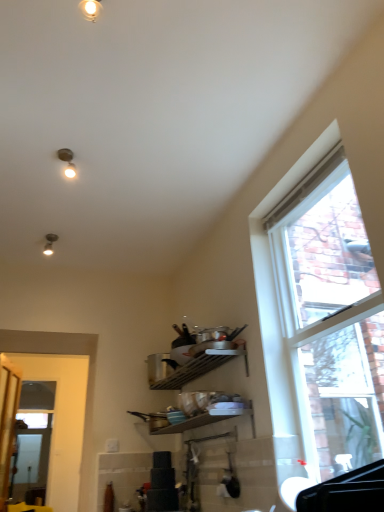
Question: Is matte silver light fixture at upper left, which ranks as the 1th light fixture in left-to-right order, further to the viewer compared to clear glass window at right?

Choices:
 (A) no
 (B) yes

Answer: (B)

Question: Does matte silver light fixture at upper left, which ranks as the 1th light fixture in left-to-right order, have a lesser height compared to clear glass window at right?

Choices:
 (A) yes
 (B) no

Answer: (A)

Question: Can you confirm if matte silver light fixture at upper left, the first light fixture from the back, is wider than clear glass window at right?

Choices:
 (A) yes
 (B) no

Answer: (B)

Question: From a real-world perspective, is matte silver light fixture at upper left, which is the 1th light fixture in bottom-to-top order, located higher than clear glass window at right?

Choices:
 (A) yes
 (B) no

Answer: (A)

Question: Can you confirm if matte silver light fixture at upper left, the first light fixture from the back, is smaller than clear glass window at right?

Choices:
 (A) yes
 (B) no

Answer: (A)

Question: Is matte silver light fixture at upper left, the 2th light fixture positioned from the right, turned away from clear glass window at right?

Choices:
 (A) no
 (B) yes

Answer: (A)

Question: Considering the relative sizes of clear glass window at right and clear glass screen door at left in the image provided, is clear glass window at right wider than clear glass screen door at left?

Choices:
 (A) yes
 (B) no

Answer: (A)

Question: From the image's perspective, is clear glass window at right under clear glass screen door at left?

Choices:
 (A) yes
 (B) no

Answer: (B)

Question: Considering the relative sizes of clear glass window at right and clear glass screen door at left in the image provided, is clear glass window at right shorter than clear glass screen door at left?

Choices:
 (A) no
 (B) yes

Answer: (B)

Question: Can clear glass screen door at left be found inside clear glass window at right?

Choices:
 (A) yes
 (B) no

Answer: (B)

Question: Would you consider clear glass window at right to be distant from clear glass screen door at left?

Choices:
 (A) yes
 (B) no

Answer: (A)

Question: Is clear glass window at right at the right side of clear glass screen door at left?

Choices:
 (A) yes
 (B) no

Answer: (A)

Question: Is matte silver light fixture at upper left, which ranks as the 1th light fixture in left-to-right order, shorter than white glossy door at left?

Choices:
 (A) no
 (B) yes

Answer: (B)